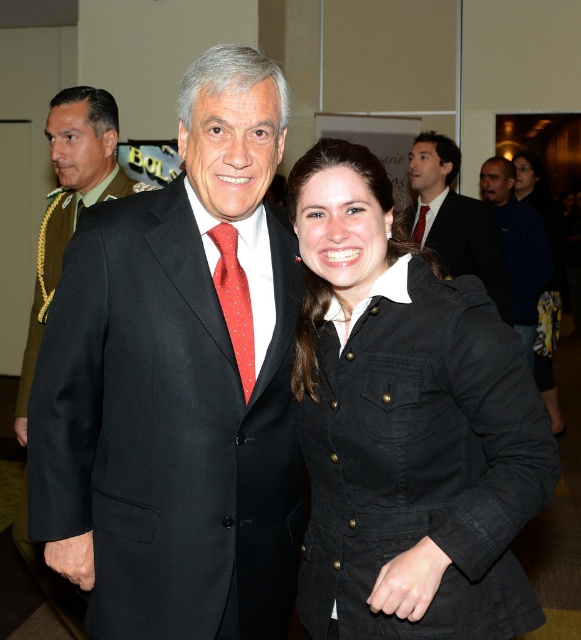
Question: Can you confirm if black matte jacket at center is thinner than matte red tie at center?

Choices:
 (A) yes
 (B) no

Answer: (B)

Question: Which is nearer to the matte black suit at center?

Choices:
 (A) dark blue fleece at right
 (B) matte red tie at center
 (C) red silk tie at center

Answer: (C)

Question: Which point is farther to the camera?

Choices:
 (A) black suit at center
 (B) black wool suit at center
 (C) matte black suit at center
 (D) black matte jacket at center

Answer: (A)

Question: Is black wool suit at center to the left of matte red tie at center from the viewer's perspective?

Choices:
 (A) yes
 (B) no

Answer: (A)

Question: Based on their relative distances, which object is farther from the black suit at center?

Choices:
 (A) red silk tie at center
 (B) matte black suit at center
 (C) matte red tie at center
 (D) dark blue fleece at right

Answer: (A)

Question: In this image, where is black matte jacket at center located relative to dark blue fleece at right?

Choices:
 (A) right
 (B) left

Answer: (B)